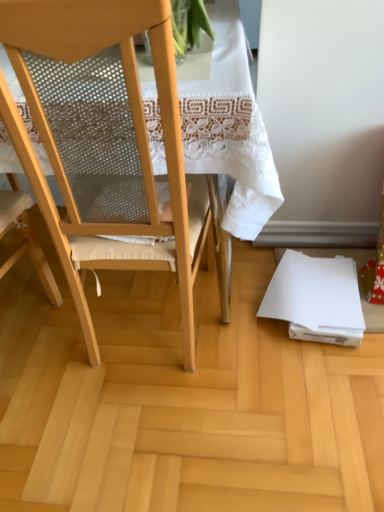
Find the location of a particular element. This screenshot has width=384, height=512. free space on the front side of matte wood chair at center is located at coordinates (148, 422).